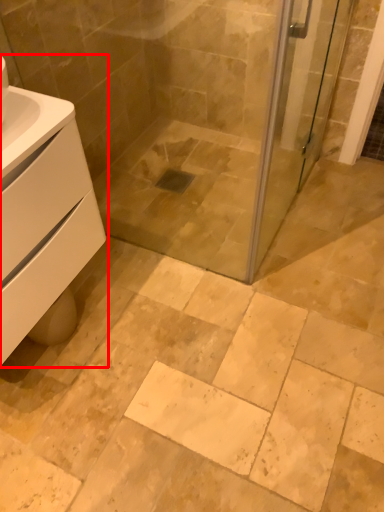
Question: From the image's perspective, where is bathroom cabinet (annotated by the red box) located relative to screen door?

Choices:
 (A) below
 (B) above

Answer: (A)